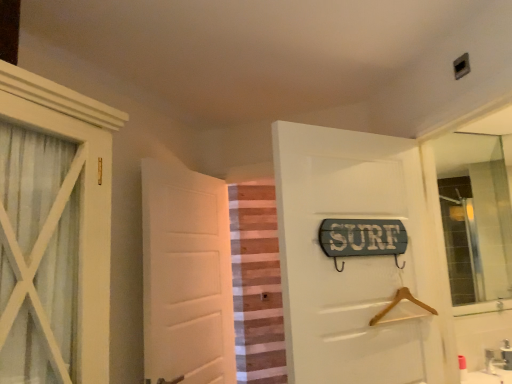
Question: Is clear glass mirror at upper right oriented away from white matte door at center, the 1th door in the left-to-right sequence?

Choices:
 (A) yes
 (B) no

Answer: (B)

Question: From the image's perspective, is clear glass mirror at upper right under white matte door at center, the first door in the back-to-front sequence?

Choices:
 (A) no
 (B) yes

Answer: (A)

Question: Can you confirm if clear glass mirror at upper right is thinner than white matte door at center, placed as the second door when sorted from front to back?

Choices:
 (A) yes
 (B) no

Answer: (A)

Question: Is clear glass mirror at upper right smaller than white matte door at center, the 1th door in the left-to-right sequence?

Choices:
 (A) no
 (B) yes

Answer: (B)

Question: From a real-world perspective, is clear glass mirror at upper right beneath white matte door at center, placed as the second door when sorted from front to back?

Choices:
 (A) no
 (B) yes

Answer: (A)

Question: Is clear glass mirror at upper right beside white matte door at center, the first door in the back-to-front sequence?

Choices:
 (A) no
 (B) yes

Answer: (A)

Question: Considering the relative sizes of clear glass mirror at upper right and striped fabric curtain at center in the image provided, is clear glass mirror at upper right thinner than striped fabric curtain at center?

Choices:
 (A) yes
 (B) no

Answer: (A)

Question: Is clear glass mirror at upper right wider than striped fabric curtain at center?

Choices:
 (A) yes
 (B) no

Answer: (B)

Question: Are clear glass mirror at upper right and striped fabric curtain at center located far from each other?

Choices:
 (A) no
 (B) yes

Answer: (B)

Question: Are clear glass mirror at upper right and striped fabric curtain at center beside each other?

Choices:
 (A) yes
 (B) no

Answer: (B)

Question: Is clear glass mirror at upper right at the right side of striped fabric curtain at center?

Choices:
 (A) no
 (B) yes

Answer: (B)

Question: Is clear glass mirror at upper right facing towards striped fabric curtain at center?

Choices:
 (A) yes
 (B) no

Answer: (B)

Question: Is white matte door at center, which is the 2th door from right to left, looking in the opposite direction of striped fabric curtain at center?

Choices:
 (A) no
 (B) yes

Answer: (A)